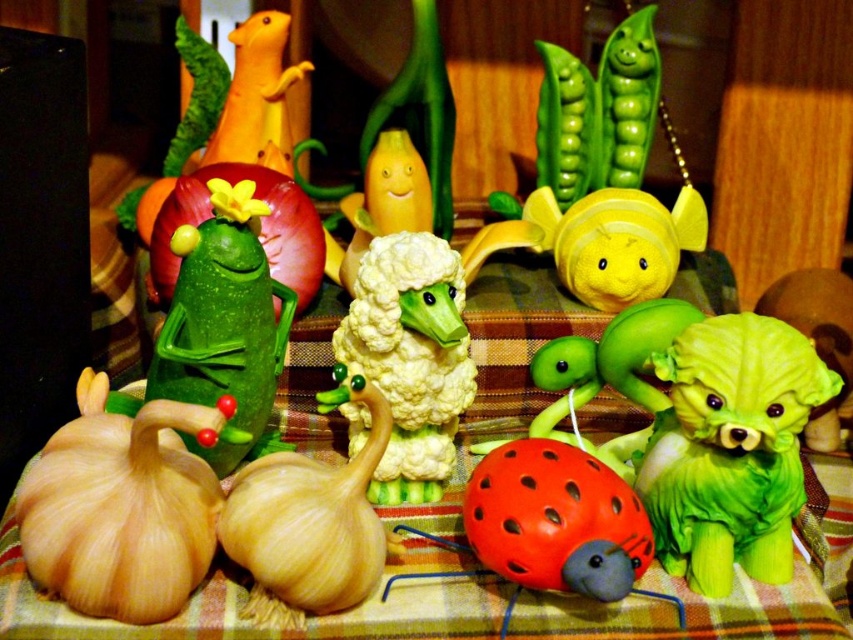
Is matte yellow rubber mouse at upper center behind green rubber lettuce at center?

Yes, matte yellow rubber mouse at upper center is further from the viewer.

Which is below, matte yellow rubber mouse at upper center or green rubber lettuce at center?

green rubber lettuce at center is lower down.

Is point (254, 36) in front of point (825, 417)?

No, it is behind (825, 417).

Locate an element on the screen. matte yellow rubber mouse at upper center is located at coordinates (256, 92).

Does smooth beige garlic at lower left lie in front of matte yellow rubber mouse at upper center?

Yes, it is in front of matte yellow rubber mouse at upper center.

Is smooth beige garlic at lower left thinner than matte yellow rubber mouse at upper center?

In fact, smooth beige garlic at lower left might be wider than matte yellow rubber mouse at upper center.

The height and width of the screenshot is (640, 853). What do you see at coordinates (122, 506) in the screenshot? I see `smooth beige garlic at lower left` at bounding box center [122, 506].

I want to click on smooth beige garlic at lower left, so click(122, 506).

Which is more to the right, rubber ladybug at center or matte yellow rubber mouse at upper center?

Positioned to the right is rubber ladybug at center.

Is rubber ladybug at center to the right of matte yellow rubber mouse at upper center from the viewer's perspective?

Indeed, rubber ladybug at center is positioned on the right side of matte yellow rubber mouse at upper center.

The image size is (853, 640). Describe the element at coordinates (550, 525) in the screenshot. I see `rubber ladybug at center` at that location.

You are a GUI agent. You are given a task and a screenshot of the screen. Output one action in this format:
    pyautogui.click(x=<x>, y=<y>)
    Task: Click on the rubber ladybug at center
    The height and width of the screenshot is (640, 853).
    Given the screenshot: What is the action you would take?
    pyautogui.click(x=550, y=525)